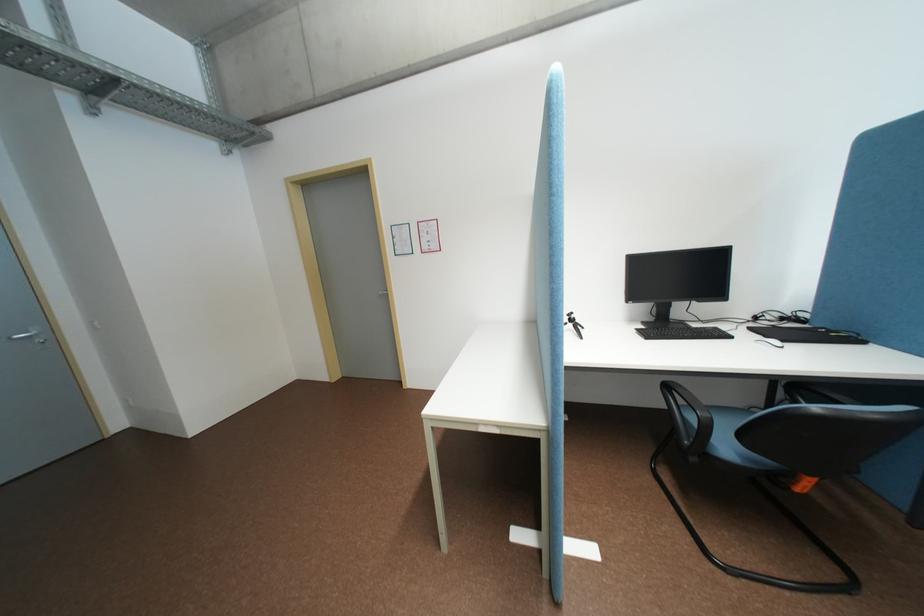
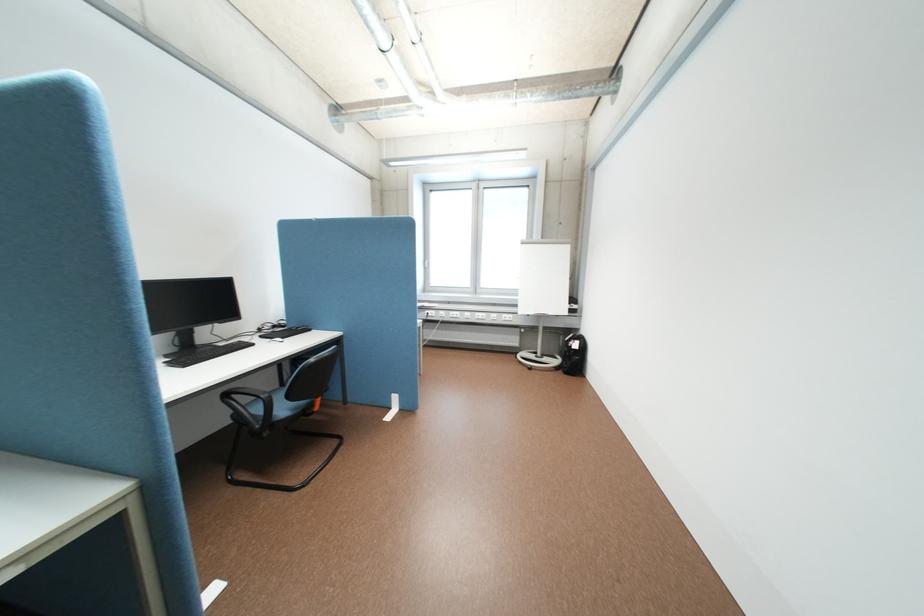
Question: The first image is from the beginning of the video and the second image is from the end. How did the camera likely rotate when shooting the video?

Choices:
 (A) Left
 (B) Right
 (C) Up
 (D) Down

Answer: (B)